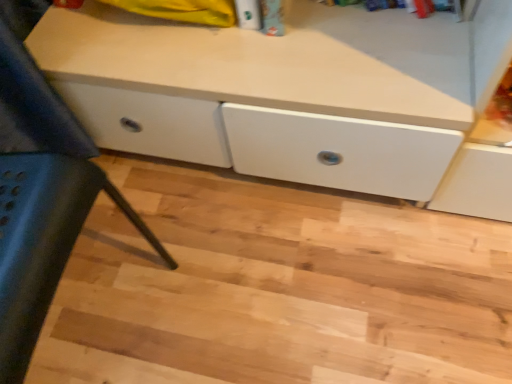
At what (x,y) coordinates should I click in order to perform the action: click on free area behind matte white cabinet at lower left. Please return your answer as a coordinate pair (x, y). Looking at the image, I should click on (128, 202).